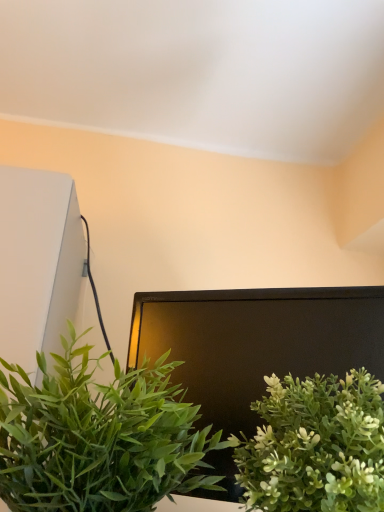
Locate an element on the screen. The width and height of the screenshot is (384, 512). green leafy plant at center, the 2th houseplant when ordered from right to left is located at coordinates (99, 437).

What do you see at coordinates (99, 437) in the screenshot?
I see `green leafy plant at center, the 2th houseplant when ordered from right to left` at bounding box center [99, 437].

The height and width of the screenshot is (512, 384). What do you see at coordinates (315, 445) in the screenshot?
I see `green matte plant at lower right, the first houseplant viewed from the right` at bounding box center [315, 445].

Find the location of `green matte plant at lower right, positioned as the second houseplant in left-to-right order`. green matte plant at lower right, positioned as the second houseplant in left-to-right order is located at coordinates (315, 445).

This screenshot has height=512, width=384. Identify the location of green leafy plant at center, the first houseplant in the left-to-right sequence. (99, 437).

Considering the positions of objects green leafy plant at center, the first houseplant in the left-to-right sequence, and green matte plant at lower right, the first houseplant viewed from the right, in the image provided, who is more to the right, green leafy plant at center, the first houseplant in the left-to-right sequence, or green matte plant at lower right, the first houseplant viewed from the right,?

green matte plant at lower right, the first houseplant viewed from the right, is more to the right.

Which is in front, green leafy plant at center, the first houseplant in the left-to-right sequence, or green matte plant at lower right, the first houseplant viewed from the right?

Positioned in front is green leafy plant at center, the first houseplant in the left-to-right sequence.

In the scene shown: Which point is more forward, (3, 383) or (331, 423)?

Positioned in front is point (331, 423).

From the image's perspective, is green leafy plant at center, the first houseplant in the left-to-right sequence, below green matte plant at lower right, positioned as the second houseplant in left-to-right order?

No.

In the scene shown: From a real-world perspective, is green leafy plant at center, the first houseplant in the left-to-right sequence, on top of green matte plant at lower right, the first houseplant viewed from the right?

Indeed, from a real-world perspective, green leafy plant at center, the first houseplant in the left-to-right sequence, stands above green matte plant at lower right, the first houseplant viewed from the right.

Is green leafy plant at center, the 2th houseplant when ordered from right to left, thinner than green matte plant at lower right, the first houseplant viewed from the right?

Correct, the width of green leafy plant at center, the 2th houseplant when ordered from right to left, is less than that of green matte plant at lower right, the first houseplant viewed from the right.

Who is shorter, green leafy plant at center, the 2th houseplant when ordered from right to left, or green matte plant at lower right, the first houseplant viewed from the right?

Standing shorter between the two is green matte plant at lower right, the first houseplant viewed from the right.

Based on their sizes in the image, would you say green leafy plant at center, the first houseplant in the left-to-right sequence, is bigger or smaller than green matte plant at lower right, the first houseplant viewed from the right?

green leafy plant at center, the first houseplant in the left-to-right sequence, is bigger than green matte plant at lower right, the first houseplant viewed from the right.

Is green leafy plant at center, the 2th houseplant when ordered from right to left, inside the boundaries of green matte plant at lower right, the first houseplant viewed from the right, or outside?

green leafy plant at center, the 2th houseplant when ordered from right to left, is not inside green matte plant at lower right, the first houseplant viewed from the right, it's outside.

Are green leafy plant at center, the 2th houseplant when ordered from right to left, and green matte plant at lower right, the first houseplant viewed from the right, far apart?

green leafy plant at center, the 2th houseplant when ordered from right to left, is actually quite close to green matte plant at lower right, the first houseplant viewed from the right.

Could you tell me if green leafy plant at center, the 2th houseplant when ordered from right to left, is facing green matte plant at lower right, positioned as the second houseplant in left-to-right order?

No, green leafy plant at center, the 2th houseplant when ordered from right to left, is not turned towards green matte plant at lower right, positioned as the second houseplant in left-to-right order.

The height and width of the screenshot is (512, 384). What are the coordinates of `houseplant that appears behind the green leafy plant at center, the first houseplant in the left-to-right sequence` in the screenshot? It's located at (315, 445).

Considering the positions of objects green matte plant at lower right, positioned as the second houseplant in left-to-right order, and green leafy plant at center, the first houseplant in the left-to-right sequence, in the image provided, who is more to the left, green matte plant at lower right, positioned as the second houseplant in left-to-right order, or green leafy plant at center, the first houseplant in the left-to-right sequence,?

green leafy plant at center, the first houseplant in the left-to-right sequence.

Based on the photo, which object is further away from the camera, green matte plant at lower right, positioned as the second houseplant in left-to-right order, or green leafy plant at center, the first houseplant in the left-to-right sequence?

green matte plant at lower right, positioned as the second houseplant in left-to-right order, is behind.

Does point (326, 381) come in front of point (145, 408)?

No, (326, 381) is behind (145, 408).

From the image's perspective, would you say green matte plant at lower right, the first houseplant viewed from the right, is shown under green leafy plant at center, the 2th houseplant when ordered from right to left?

Yes.

From a real-world perspective, which object rests below the other?

From a 3D spatial view, green matte plant at lower right, the first houseplant viewed from the right, is below.

Looking at their sizes, would you say green matte plant at lower right, the first houseplant viewed from the right, is wider or thinner than green leafy plant at center, the 2th houseplant when ordered from right to left?

Considering their sizes, green matte plant at lower right, the first houseplant viewed from the right, looks broader than green leafy plant at center, the 2th houseplant when ordered from right to left.

Is green matte plant at lower right, the first houseplant viewed from the right, shorter than green leafy plant at center, the 2th houseplant when ordered from right to left?

Indeed, green matte plant at lower right, the first houseplant viewed from the right, has a lesser height compared to green leafy plant at center, the 2th houseplant when ordered from right to left.

In terms of size, does green matte plant at lower right, positioned as the second houseplant in left-to-right order, appear bigger or smaller than green leafy plant at center, the first houseplant in the left-to-right sequence?

In the image, green matte plant at lower right, positioned as the second houseplant in left-to-right order, appears to be smaller than green leafy plant at center, the first houseplant in the left-to-right sequence.

Is green leafy plant at center, the first houseplant in the left-to-right sequence, a part of green matte plant at lower right, the first houseplant viewed from the right?

No, green leafy plant at center, the first houseplant in the left-to-right sequence, is not surrounded by green matte plant at lower right, the first houseplant viewed from the right.

Would you consider green matte plant at lower right, the first houseplant viewed from the right, to be distant from green leafy plant at center, the 2th houseplant when ordered from right to left?

green matte plant at lower right, the first houseplant viewed from the right, is actually quite close to green leafy plant at center, the 2th houseplant when ordered from right to left.

Is green matte plant at lower right, positioned as the second houseplant in left-to-right order, looking in the opposite direction of green leafy plant at center, the 2th houseplant when ordered from right to left?

green matte plant at lower right, positioned as the second houseplant in left-to-right order, does not have its back to green leafy plant at center, the 2th houseplant when ordered from right to left.

Measure the distance between green matte plant at lower right, positioned as the second houseplant in left-to-right order, and green leafy plant at center, the first houseplant in the left-to-right sequence.

5.00 inches.

Where is `houseplant lying below the green leafy plant at center, the first houseplant in the left-to-right sequence (from the image's perspective)`? houseplant lying below the green leafy plant at center, the first houseplant in the left-to-right sequence (from the image's perspective) is located at coordinates (315, 445).

In the image, there is a green leafy plant at center, the first houseplant in the left-to-right sequence. Where is `houseplant below it (from the image's perspective)`? This screenshot has width=384, height=512. houseplant below it (from the image's perspective) is located at coordinates (315, 445).

You are a GUI agent. You are given a task and a screenshot of the screen. Output one action in this format:
    pyautogui.click(x=<x>, y=<y>)
    Task: Click on the houseplant behind the green leafy plant at center, the first houseplant in the left-to-right sequence
    
    Given the screenshot: What is the action you would take?
    pyautogui.click(x=315, y=445)